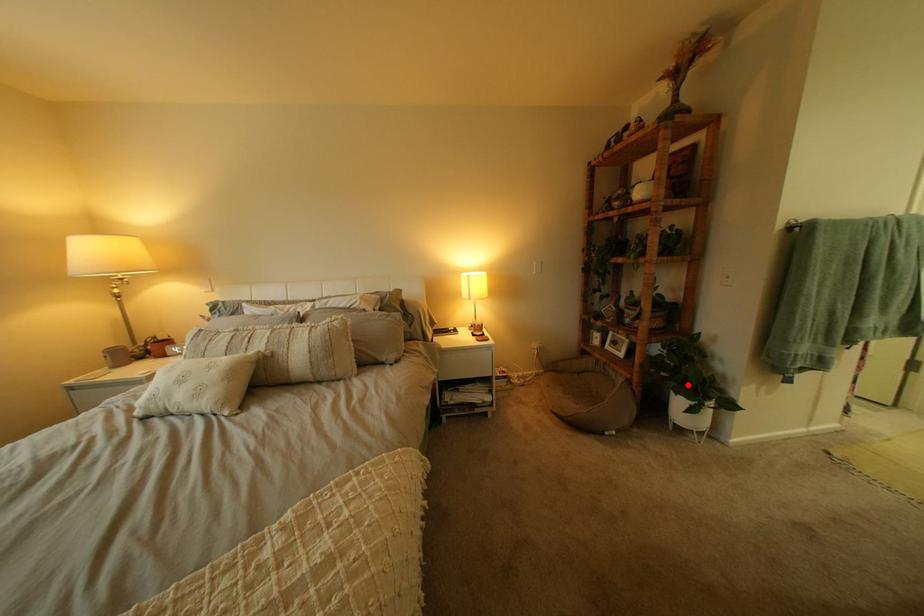
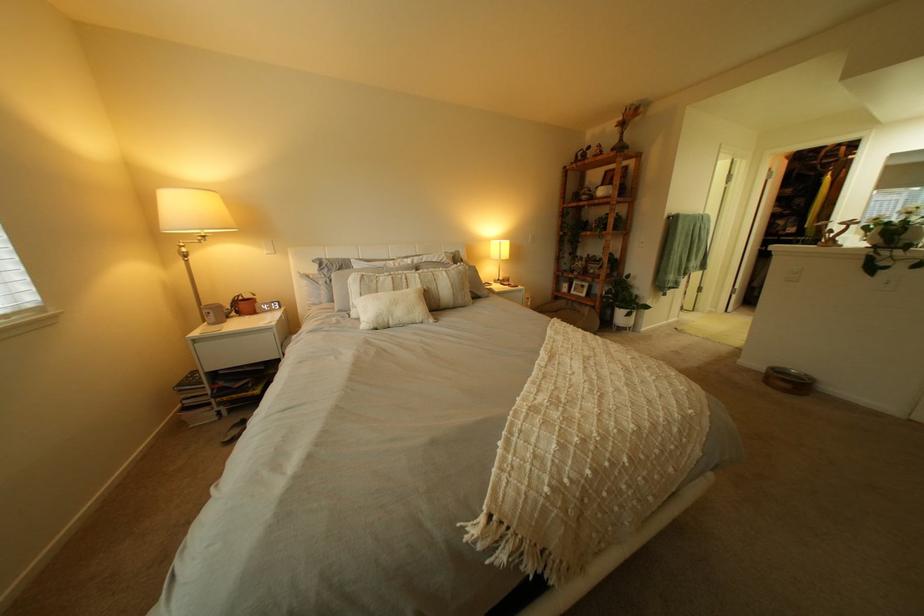
The point at the highlighted location is marked in the first image. Where is the corresponding point in the second image?

(633, 305)